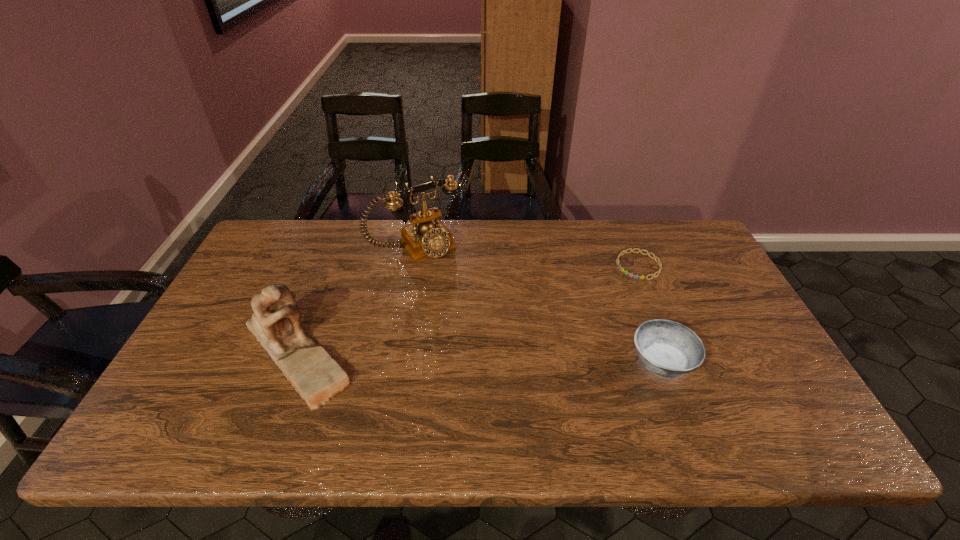
Point out which object is positioned as the nearest to the shortest object. Please provide its 2D coordinates. Your answer should be formatted as a tuple, i.e. [(x, y)], where the tuple contains the x and y coordinates of a point satisfying the conditions above.

[(668, 349)]

Identify the location of free point that satisfies the following two spatial constraints: 1. on the front-facing side of the figurine; 2. on the left side of the second shortest object. This screenshot has height=540, width=960. (292, 362).

You are a GUI agent. You are given a task and a screenshot of the screen. Output one action in this format:
    pyautogui.click(x=<x>, y=<y>)
    Task: Click on the blank space that satisfies the following two spatial constraints: 1. on the front side of the telephone; 2. on the right side of the second shortest object
    This screenshot has height=540, width=960.
    Given the screenshot: What is the action you would take?
    pyautogui.click(x=396, y=362)